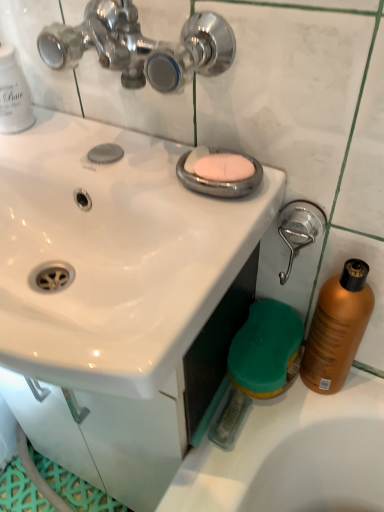
Question: Looking at their shapes, would you say shiny orange bottle at right is wider or thinner than pink matte soap at center?

Choices:
 (A) wide
 (B) thin

Answer: (A)

Question: From the image's perspective, is shiny orange bottle at right above or below pink matte soap at center?

Choices:
 (A) below
 (B) above

Answer: (A)

Question: Estimate the real-world distances between objects in this image. Which object is farther from the white glossy sink at upper center?

Choices:
 (A) shiny orange bottle at right
 (B) brushed metal shower head at right
 (C) pink matte soap at center

Answer: (A)

Question: Estimate the real-world distances between objects in this image. Which object is farther from the white glossy sink at upper center?

Choices:
 (A) pink matte soap at center
 (B) brushed metal shower head at right
 (C) shiny orange bottle at right

Answer: (C)